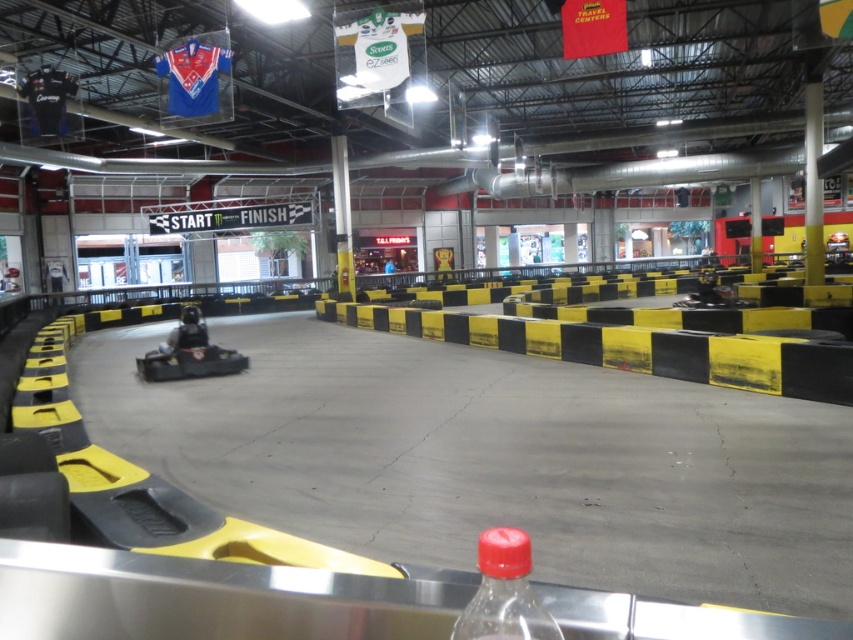
Question: Is black/yellow striped barrier at center further to the viewer compared to translucent plastic bottle at lower center?

Choices:
 (A) no
 (B) yes

Answer: (B)

Question: Does black/yellow striped barrier at center lie in front of translucent plastic bottle at lower center?

Choices:
 (A) no
 (B) yes

Answer: (A)

Question: Which object appears closest to the camera in this image?

Choices:
 (A) translucent plastic bottle at lower center
 (B) black/yellow striped barrier at center

Answer: (A)

Question: Which object is closer to the camera taking this photo?

Choices:
 (A) translucent plastic bottle at lower center
 (B) black/yellow striped barrier at center

Answer: (A)

Question: Does black/yellow striped barrier at center have a smaller size compared to translucent plastic bottle at lower center?

Choices:
 (A) yes
 (B) no

Answer: (B)